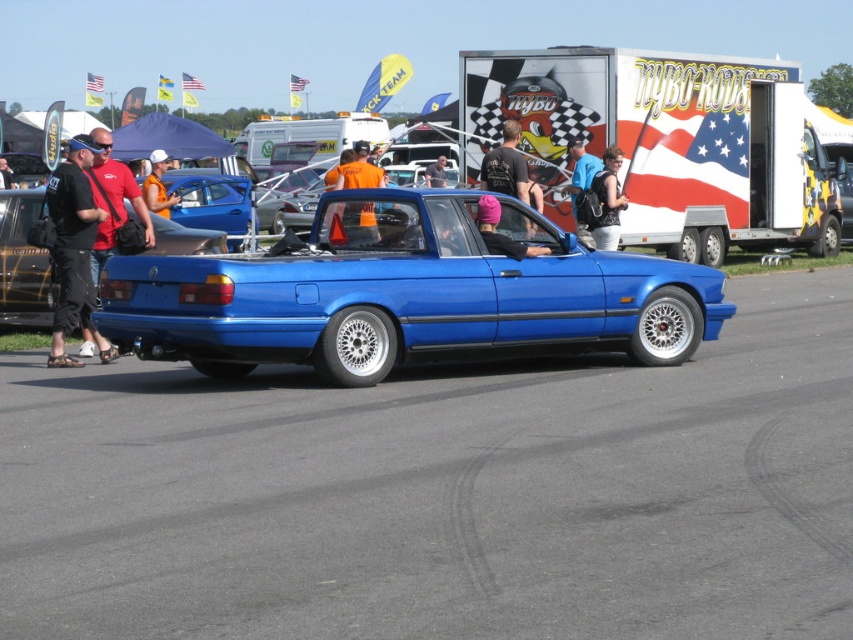
You are organizing a car show and need to place a black fabric bag at left and a pink fabric headband at center on a display table. The table has limited space. Which item requires more horizontal space?

The black fabric bag at left requires more horizontal space because its width surpasses that of the pink fabric headband at center.

You are a photographer at the car show and need to capture a clear shot of both the black fabric bag at left and the pink fabric headband at center without any obstructions. Can you adjust your position to ensure both are visible in the frame?

The pink fabric headband at center is behind the black fabric bag at left, so you need to move your camera angle to either the right or left to ensure both are visible without one blocking the other.